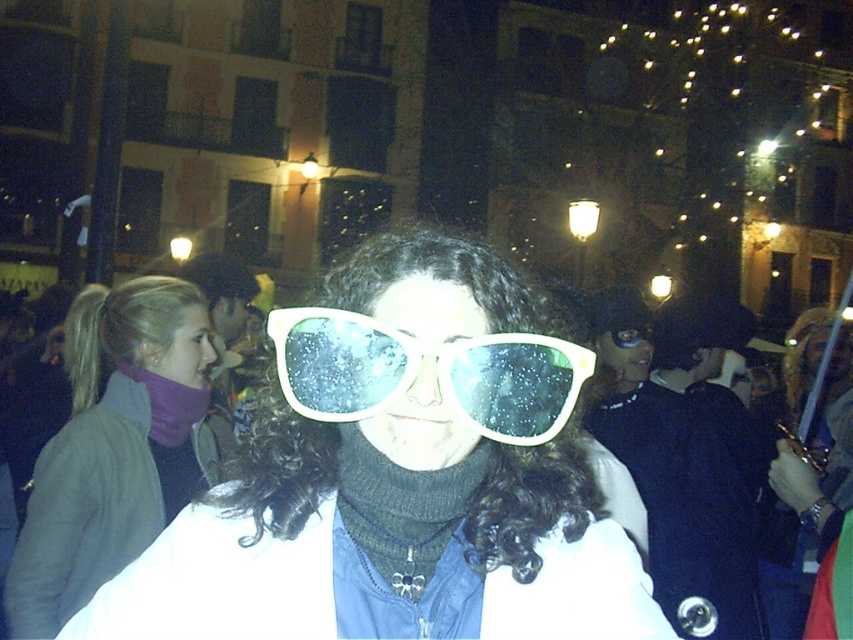
Can you confirm if white plastic sunglasses at center is positioned to the right of white plastic goggles at center?

In fact, white plastic sunglasses at center is to the left of white plastic goggles at center.

Is white plastic sunglasses at center thinner than white plastic goggles at center?

In fact, white plastic sunglasses at center might be wider than white plastic goggles at center.

Is point (248, 584) farther from viewer compared to point (564, 340)?

Yes, it is behind point (564, 340).

Find the location of `white plastic sunglasses at center`. white plastic sunglasses at center is located at coordinates (399, 476).

Which is above, white plastic sunglasses at center or matte purple scarf at upper left?

matte purple scarf at upper left is above.

Which of these two, white plastic sunglasses at center or matte purple scarf at upper left, stands taller?

matte purple scarf at upper left

The image size is (853, 640). In order to click on white plastic sunglasses at center in this screenshot , I will do `click(399, 476)`.

Identify the location of white plastic sunglasses at center. (399, 476).

Can you confirm if matte purple scarf at upper left is positioned to the right of white plastic goggles at center?

Incorrect, matte purple scarf at upper left is not on the right side of white plastic goggles at center.

Measure the distance between matte purple scarf at upper left and camera.

matte purple scarf at upper left and camera are 8.13 feet apart.

Is point (112, 465) farther from viewer compared to point (378, 324)?

That is True.

Where is `matte purple scarf at upper left`? The height and width of the screenshot is (640, 853). matte purple scarf at upper left is located at coordinates (115, 445).